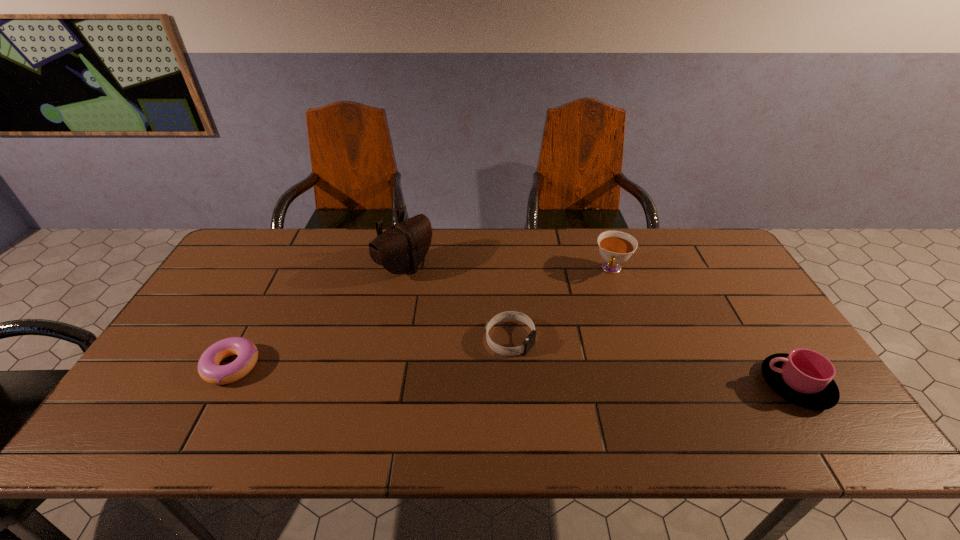
At what (x,y) coordinates should I click in order to perform the action: click on vacant space on the desktop that is between the leftmost object and the cup and is positioned on the outer surface of the third object from right to left. Please return your answer as a coordinate pair (x, y). This screenshot has height=540, width=960. Looking at the image, I should click on (586, 378).

The width and height of the screenshot is (960, 540). Find the location of `vacant spot on the desktop that is between the leftmost object and the rightmost object and is positioned on the side of the teacup with the handle`. vacant spot on the desktop that is between the leftmost object and the rightmost object and is positioned on the side of the teacup with the handle is located at coordinates (579, 378).

Locate an element on the screen. Image resolution: width=960 pixels, height=540 pixels. vacant space on the desktop that is between the leftmost object and the third shortest object and is positioned with the flap open on the fourth object from right to left is located at coordinates (585, 378).